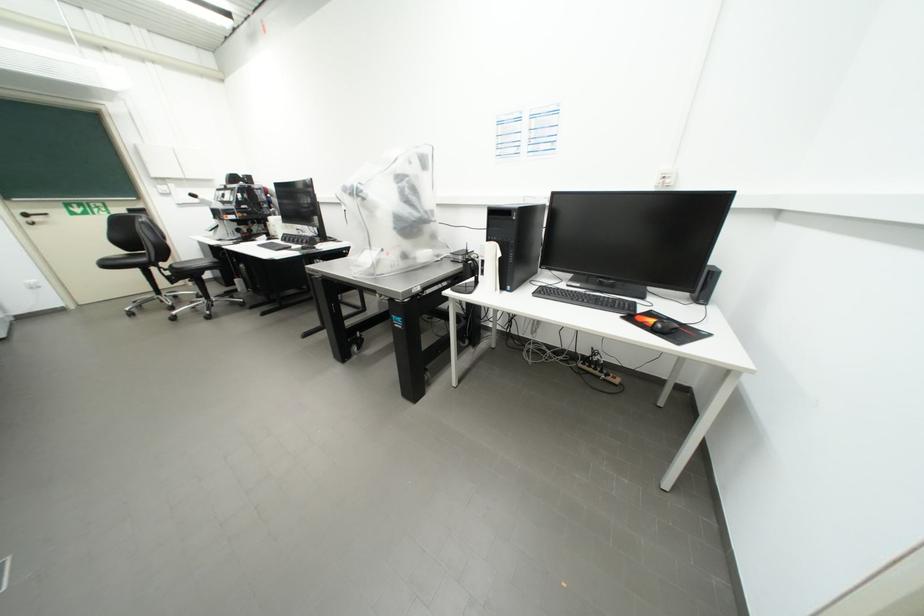
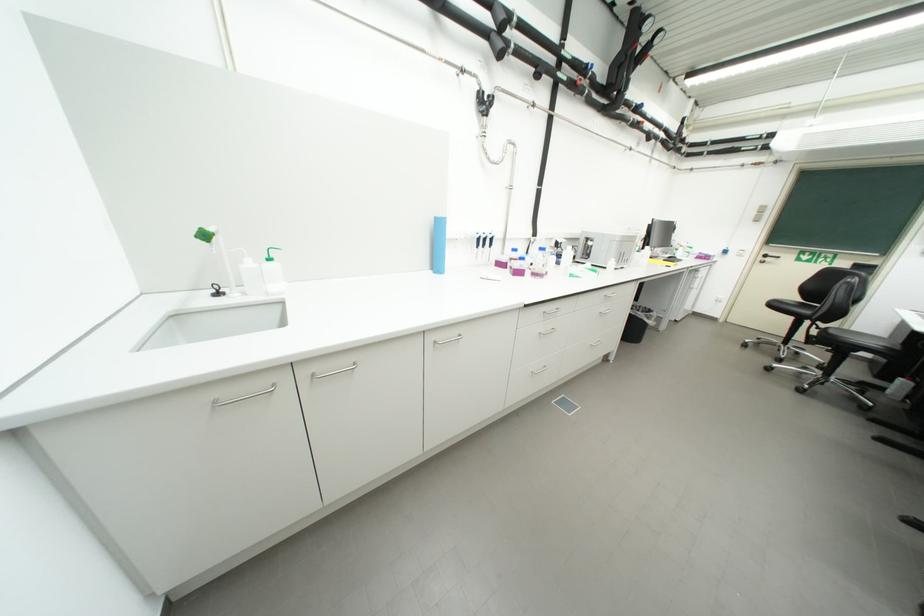
Locate, in the second image, the point that corresponds to point 117,265 in the first image.

(783, 307)